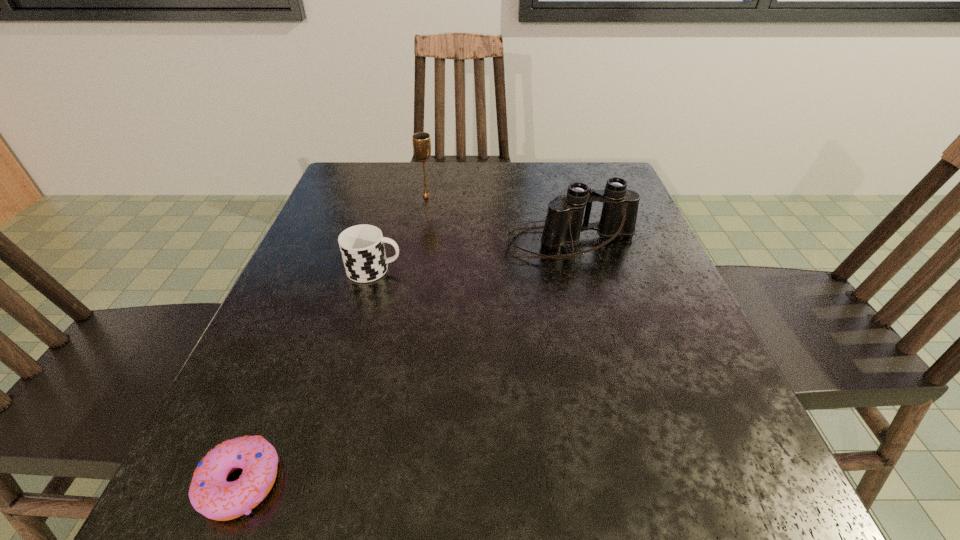
This screenshot has height=540, width=960. Find the location of `the farthest object`. the farthest object is located at coordinates point(421,141).

The height and width of the screenshot is (540, 960). What are the coordinates of `the second object from right to left` in the screenshot? It's located at (421, 141).

This screenshot has width=960, height=540. I want to click on binoculars, so click(563, 224).

Image resolution: width=960 pixels, height=540 pixels. I want to click on cup, so click(x=362, y=248).

Identify the location of the nearest object. This screenshot has height=540, width=960. pos(210,494).

The image size is (960, 540). Find the location of `doughnut`. doughnut is located at coordinates (210, 494).

Find the location of a particular element. The height and width of the screenshot is (540, 960). vacant space located on the right of the second object from right to left is located at coordinates (582, 196).

This screenshot has height=540, width=960. Identify the location of vacant space located on the back of the rightmost object. (558, 193).

Identify the location of free space located 0.340m on the side of the cup with the handle. (574, 270).

The width and height of the screenshot is (960, 540). Identify the location of vacant space positioned on the right of the shortest object. (383, 483).